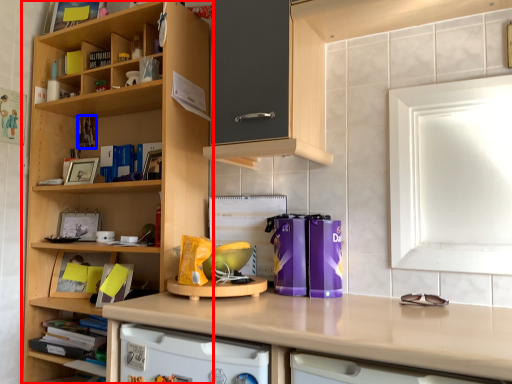
Question: Which object appears farthest to the camera in this image, cupboard (highlighted by a red box) or book (highlighted by a blue box)?

Choices:
 (A) cupboard
 (B) book

Answer: (B)